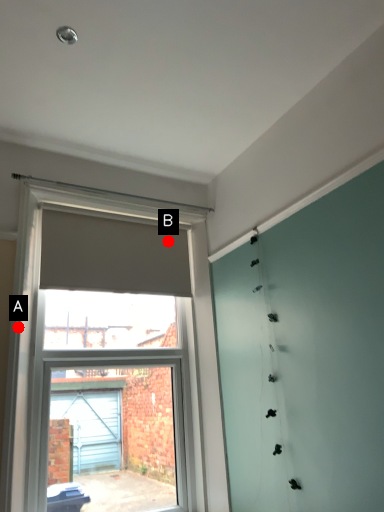
Question: Two points are circled on the image, labeled by A and B beside each circle. Which point is closer to the camera?

Choices:
 (A) A is closer
 (B) B is closer

Answer: (A)